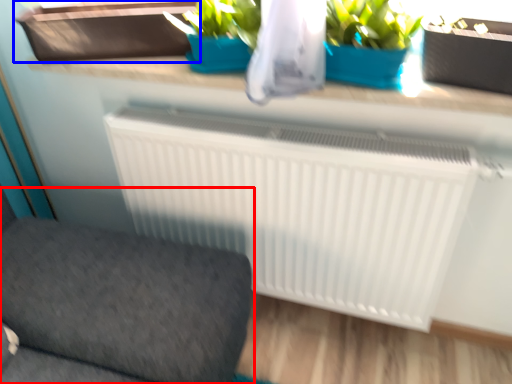
Question: Which point is closer to the camera, furniture (highlighted by a red box) or window box (highlighted by a blue box)?

Choices:
 (A) furniture
 (B) window box

Answer: (A)